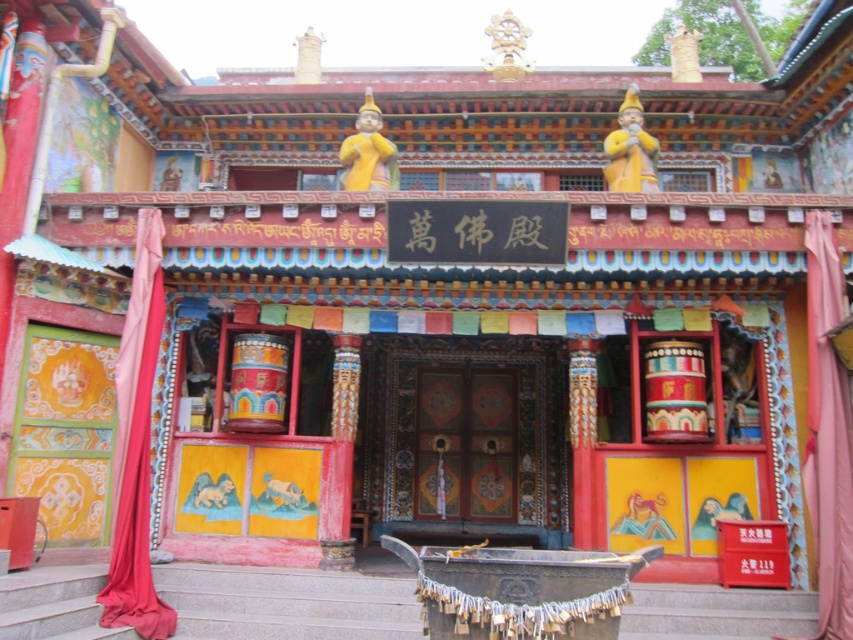
You are a visitor at the temple entrance. You need to enter the building through the painted wood door at center. However, you notice the pink fabric curtain at right is blocking the entrance. Can you walk through the door without moving the curtain?

The painted wood door at center is shorter than the pink fabric curtain at right, so the curtain may be hanging above the door. Since the door is shorter, there might be enough space below the curtain to walk through without moving it.